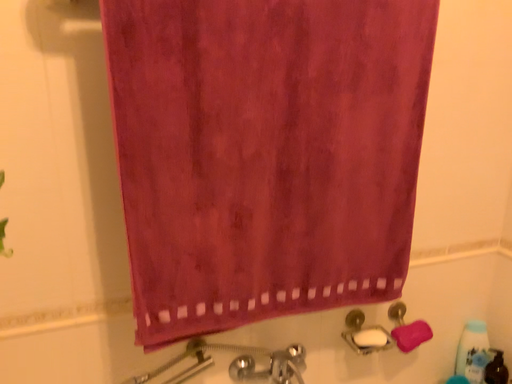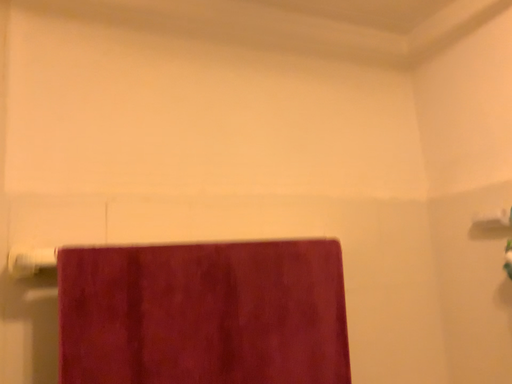
Question: Which way did the camera rotate in the video?

Choices:
 (A) rotated upward
 (B) rotated downward

Answer: (A)